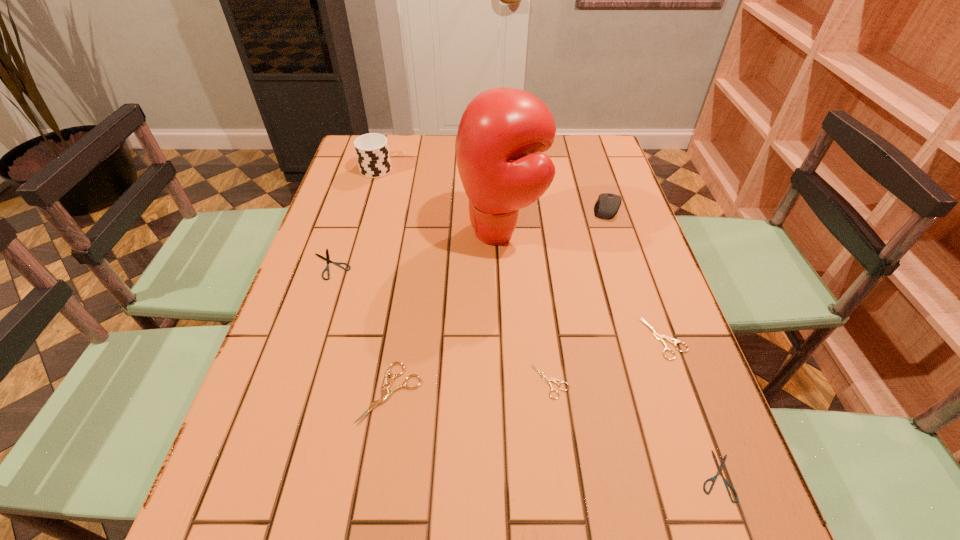
You are a GUI agent. You are given a task and a screenshot of the screen. Output one action in this format:
    pyautogui.click(x=<x>, y=<y>)
    Task: Click on the second beige shears from right to left
    This screenshot has width=960, height=540.
    Given the screenshot: What is the action you would take?
    pyautogui.click(x=547, y=380)

You are a GUI agent. You are given a task and a screenshot of the screen. Output one action in this format:
    pyautogui.click(x=<x>, y=<y>)
    Task: Click on the third shears from left to right
    Image resolution: width=960 pixels, height=540 pixels.
    Given the screenshot: What is the action you would take?
    pyautogui.click(x=547, y=380)

The height and width of the screenshot is (540, 960). What are the coordinates of `the farthest shears` in the screenshot? It's located at (327, 259).

At what (x,y) coordinates should I click in order to perform the action: click on the bigger black shears. Please return your answer as a coordinate pair (x, y). The height and width of the screenshot is (540, 960). Looking at the image, I should click on click(327, 259).

In order to click on the nearer black shears in this screenshot , I will do `click(713, 479)`.

Find the location of `the smaller black shears`. the smaller black shears is located at coordinates (713, 479).

Where is `blank space located 0.320m on the striking surface of the tallest object`? blank space located 0.320m on the striking surface of the tallest object is located at coordinates (344, 233).

Locate an element on the screen. This screenshot has height=540, width=960. vacant space located on the striking surface of the tallest object is located at coordinates (329, 233).

You are a GUI agent. You are given a task and a screenshot of the screen. Output one action in this format:
    pyautogui.click(x=<x>, y=<y>)
    Task: Click on the free spot located on the striking surface of the tallest object
    This screenshot has height=540, width=960.
    Given the screenshot: What is the action you would take?
    click(401, 233)

The height and width of the screenshot is (540, 960). In order to click on free spot located 0.130m on the side of the black cup with the handle in this screenshot , I will do `click(386, 137)`.